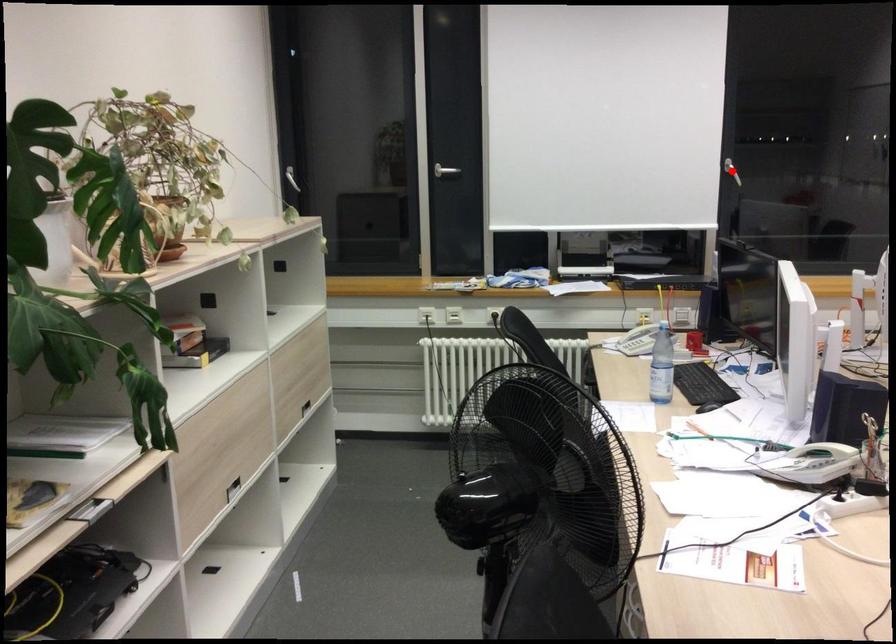
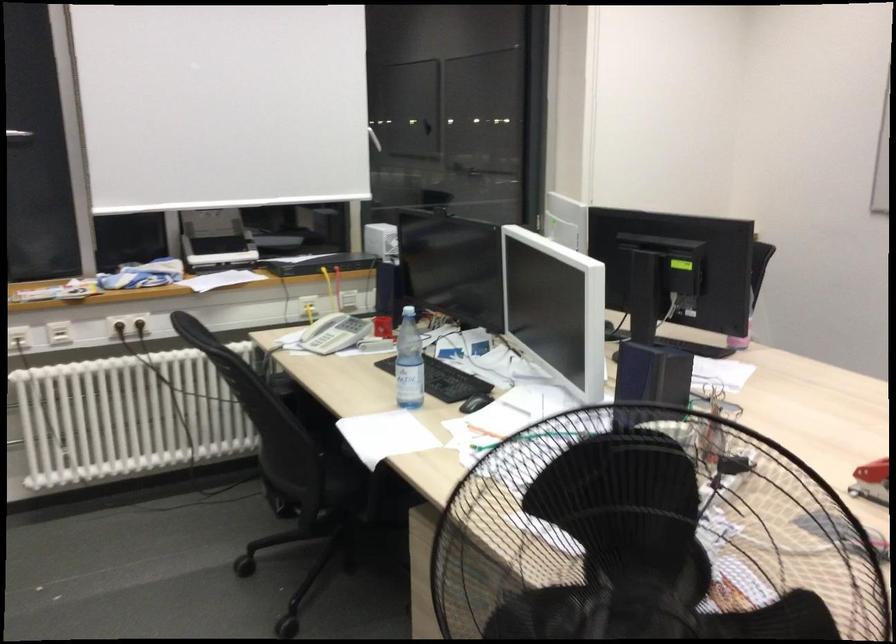
Question: I am providing you with two images of the same scene from different viewpoints. A red point is marked on the first image. Is the red point's position out of view in image 2?

Choices:
 (A) Yes
 (B) No

Answer: (A)